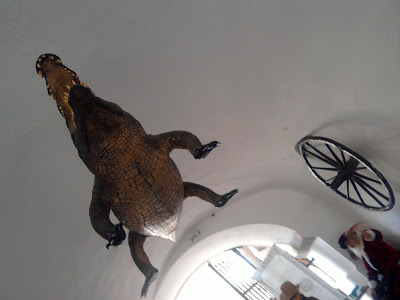
The width and height of the screenshot is (400, 300). Find the location of `white curved ceiling on right sice of aligator image`. white curved ceiling on right sice of aligator image is located at coordinates (199, 64), (268, 56).